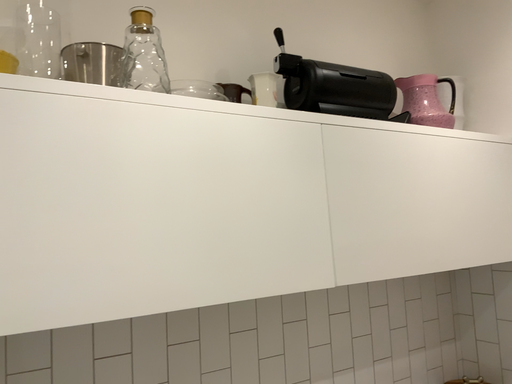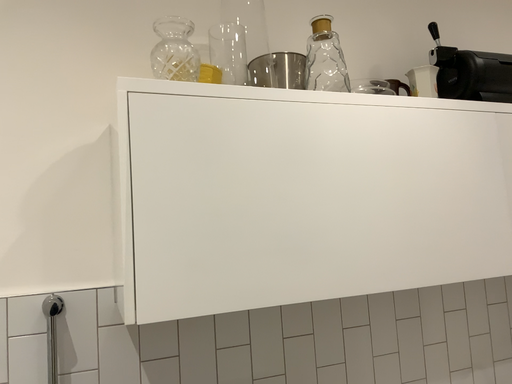
Question: How did the camera likely rotate when shooting the video?

Choices:
 (A) rotated left
 (B) rotated right

Answer: (A)